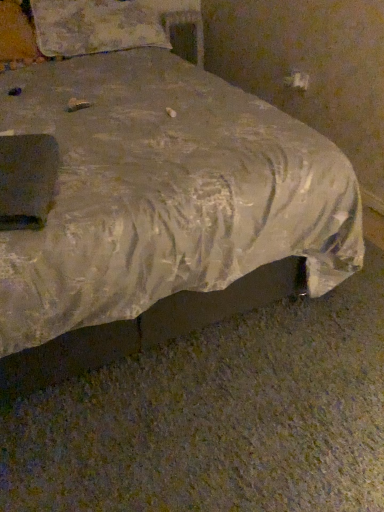
What do you see at coordinates (94, 27) in the screenshot? Image resolution: width=384 pixels, height=512 pixels. I see `white fabric pillow at upper left` at bounding box center [94, 27].

In order to click on white fabric pillow at upper left in this screenshot , I will do `click(94, 27)`.

What do you see at coordinates (162, 211) in the screenshot? I see `silvery fabric bed at center` at bounding box center [162, 211].

Find the location of a particular element. The width and height of the screenshot is (384, 512). silvery fabric bed at center is located at coordinates (162, 211).

Locate an element on the screen. This screenshot has width=384, height=512. white fabric pillow at upper left is located at coordinates (94, 27).

Which object is positioned more to the left, silvery fabric bed at center or white fabric pillow at upper left?

From the viewer's perspective, white fabric pillow at upper left appears more on the left side.

Does silvery fabric bed at center lie behind white fabric pillow at upper left?

No, silvery fabric bed at center is in front of white fabric pillow at upper left.

Does point (35, 259) come closer to viewer compared to point (127, 18)?

Yes, it is.

From the image's perspective, between silvery fabric bed at center and white fabric pillow at upper left, who is located below?

silvery fabric bed at center appears lower in the image.

From a real-world perspective, between silvery fabric bed at center and white fabric pillow at upper left, who is vertically lower?

In real-world perspective, silvery fabric bed at center is lower.

Can you confirm if silvery fabric bed at center is wider than white fabric pillow at upper left?

Indeed, silvery fabric bed at center has a greater width compared to white fabric pillow at upper left.

Does silvery fabric bed at center have a lesser height compared to white fabric pillow at upper left?

In fact, silvery fabric bed at center may be taller than white fabric pillow at upper left.

Is silvery fabric bed at center bigger or smaller than white fabric pillow at upper left?

silvery fabric bed at center is bigger than white fabric pillow at upper left.

Is silvery fabric bed at center not inside white fabric pillow at upper left?

Yes, silvery fabric bed at center is not within white fabric pillow at upper left.

Does silvery fabric bed at center touch white fabric pillow at upper left?

There is a gap between silvery fabric bed at center and white fabric pillow at upper left.

Could you tell me if silvery fabric bed at center is facing white fabric pillow at upper left?

No, silvery fabric bed at center is not oriented towards white fabric pillow at upper left.

You are a GUI agent. You are given a task and a screenshot of the screen. Output one action in this format:
    pyautogui.click(x=<x>, y=<y>)
    Task: Click on the bed in front of the white fabric pillow at upper left
    The height and width of the screenshot is (512, 384).
    Given the screenshot: What is the action you would take?
    pyautogui.click(x=162, y=211)

Is white fabric pillow at upper left to the left or to the right of silvery fabric bed at center in the image?

Based on their positions, white fabric pillow at upper left is located to the left of silvery fabric bed at center.

Based on the photo, who is more distant, white fabric pillow at upper left or silvery fabric bed at center?

Positioned behind is white fabric pillow at upper left.

Between point (90, 0) and point (108, 354), which one is positioned behind?

The point (90, 0) is more distant.

From the image's perspective, which one is positioned lower, white fabric pillow at upper left or silvery fabric bed at center?

silvery fabric bed at center appears lower in the image.

From a real-world perspective, which is physically below, white fabric pillow at upper left or silvery fabric bed at center?

silvery fabric bed at center is physically lower.

Considering the relative sizes of white fabric pillow at upper left and silvery fabric bed at center in the image provided, is white fabric pillow at upper left wider than silvery fabric bed at center?

No, white fabric pillow at upper left is not wider than silvery fabric bed at center.

Which of these two, white fabric pillow at upper left or silvery fabric bed at center, stands shorter?

white fabric pillow at upper left.

Considering the relative sizes of white fabric pillow at upper left and silvery fabric bed at center in the image provided, is white fabric pillow at upper left bigger than silvery fabric bed at center?

No.

Which is correct: white fabric pillow at upper left is inside silvery fabric bed at center, or outside of it?

white fabric pillow at upper left is enclosed within silvery fabric bed at center.

Is white fabric pillow at upper left beside silvery fabric bed at center?

No, white fabric pillow at upper left is not touching silvery fabric bed at center.

Could you tell me if white fabric pillow at upper left is facing silvery fabric bed at center?

Yes, white fabric pillow at upper left is oriented towards silvery fabric bed at center.

Can you tell me how much white fabric pillow at upper left and silvery fabric bed at center differ in facing direction?

The angular difference between white fabric pillow at upper left and silvery fabric bed at center is 0.418 degrees.

This screenshot has width=384, height=512. Identify the location of bed in front of the white fabric pillow at upper left. pos(162,211).

The width and height of the screenshot is (384, 512). What are the coordinates of `pillow above the silvery fabric bed at center (from a real-world perspective)` in the screenshot? It's located at (94, 27).

At what (x,y) coordinates should I click in order to perform the action: click on pillow behind the silvery fabric bed at center. Please return your answer as a coordinate pair (x, y). This screenshot has width=384, height=512. Looking at the image, I should click on (94, 27).